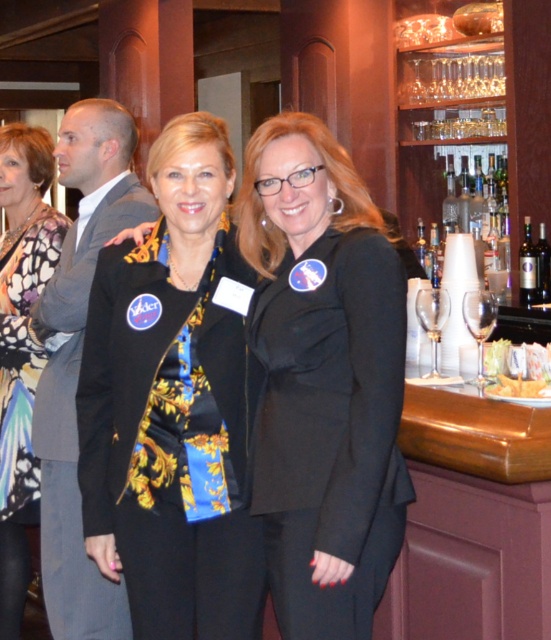
Question: Is black satin blazer at center wider than black matte blazer at center?

Choices:
 (A) yes
 (B) no

Answer: (A)

Question: Is black satin blazer at center thinner than floral fabric scarf at left?

Choices:
 (A) no
 (B) yes

Answer: (A)

Question: Can you confirm if gray suit at left is bigger than floral fabric scarf at left?

Choices:
 (A) no
 (B) yes

Answer: (A)

Question: Which object is positioned farthest from the black satin blazer at center?

Choices:
 (A) floral fabric scarf at left
 (B) black matte blazer at center

Answer: (A)

Question: Which object is farther from the camera taking this photo?

Choices:
 (A) gray suit at left
 (B) black matte blazer at center
 (C) black satin blazer at center

Answer: (A)

Question: Estimate the real-world distances between objects in this image. Which object is farther from the black matte blazer at center?

Choices:
 (A) floral fabric scarf at left
 (B) black satin blazer at center
 (C) gray suit at left

Answer: (A)